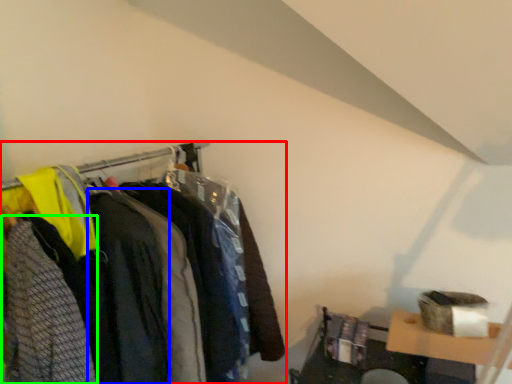
Question: Which object is the closest to the closet (highlighted by a red box)? Choose among these: clothing (highlighted by a blue box) or clothing (highlighted by a green box).

Choices:
 (A) clothing
 (B) clothing

Answer: (A)